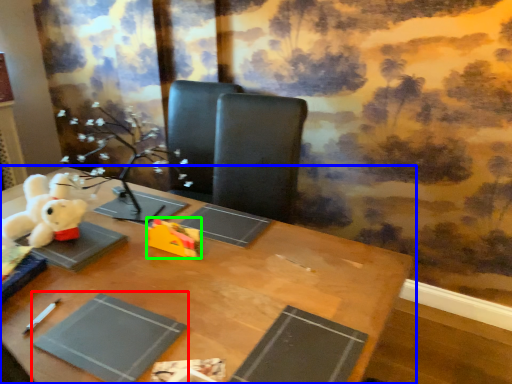
Question: Which is farther away from paperback book (highlighted by a red box)? table (highlighted by a blue box) or toy (highlighted by a green box)?

Choices:
 (A) table
 (B) toy

Answer: (B)